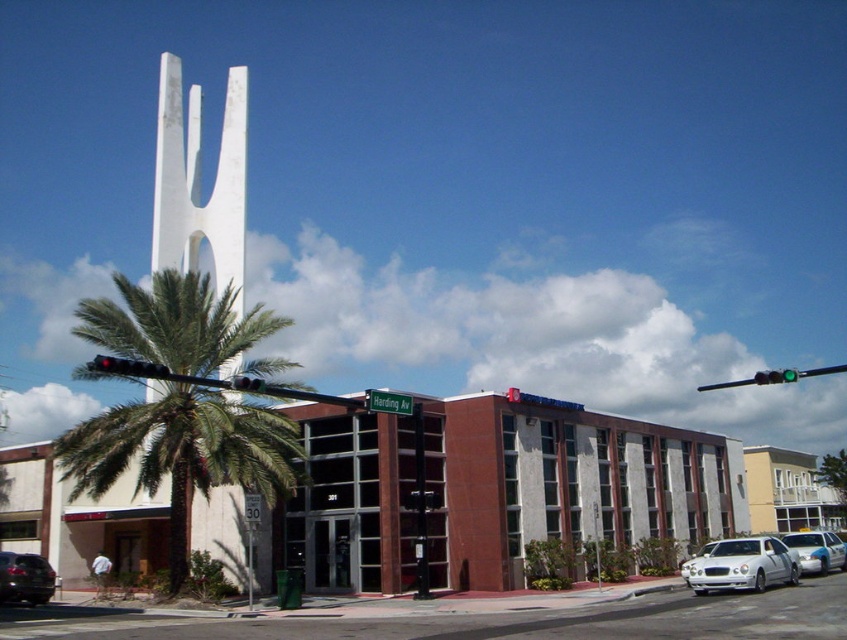
Question: Can you confirm if white glossy sedan at lower right is positioned below green glass traffic light at upper center?

Choices:
 (A) yes
 (B) no

Answer: (A)

Question: Which of the following is the closest to the observer?

Choices:
 (A) (237, 387)
 (B) (837, 563)
 (C) (185, 525)
 (D) (739, 541)

Answer: (A)

Question: Which of the following is the farthest from the observer?

Choices:
 (A) white glossy sedan at lower right
 (B) matte black suv at lower left
 (C) green leafy palm tree at left
 (D) black glass traffic light at upper center

Answer: (B)

Question: Is white glossy sedan at lower right below matte black suv at lower left?

Choices:
 (A) yes
 (B) no

Answer: (B)

Question: Considering the real-world distances, which object is farthest from the white glossy sedan at lower right?

Choices:
 (A) blue metallic sedan at center
 (B) matte black suv at lower left
 (C) green glass traffic light at upper center
 (D) black glass traffic light at upper center

Answer: (B)

Question: Does green glass traffic light at upper right have a larger size compared to green glass traffic light at upper center?

Choices:
 (A) yes
 (B) no

Answer: (A)